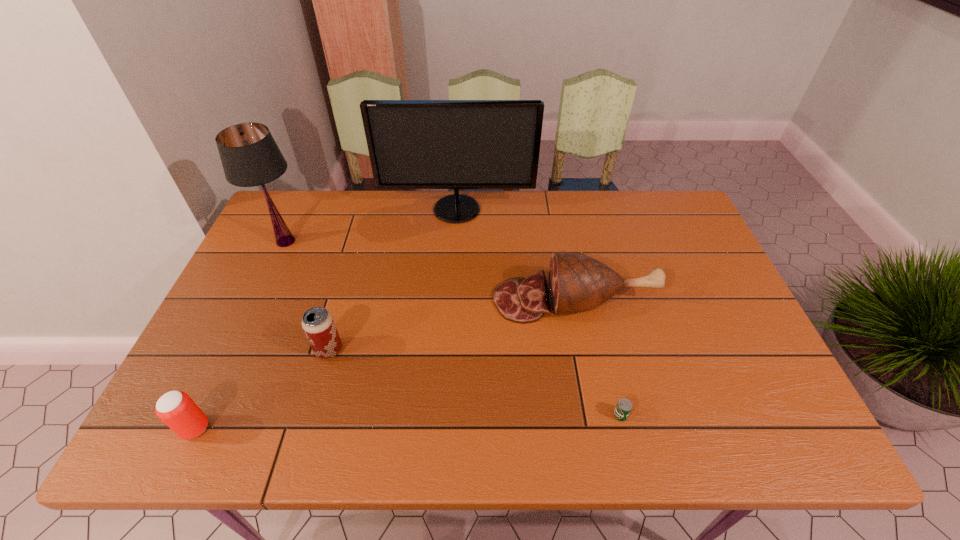
Identify the location of vacant space that satisfies the following two spatial constraints: 1. on the front-facing side of the lampshade; 2. on the back side of the fourth farthest object. The width and height of the screenshot is (960, 540). (236, 350).

Locate an element on the screen. The height and width of the screenshot is (540, 960). free point that satisfies the following two spatial constraints: 1. on the front-facing side of the second beer can from left to right; 2. on the left side of the second farthest object is located at coordinates (236, 350).

What are the coordinates of `free region that satisfies the following two spatial constraints: 1. on the front-facing side of the farthest object; 2. on the right side of the shortest object` in the screenshot? It's located at (444, 415).

Identify the location of free region that satisfies the following two spatial constraints: 1. on the back side of the leftmost beer can; 2. on the right side of the rightmost beer can. This screenshot has width=960, height=540. (202, 415).

Image resolution: width=960 pixels, height=540 pixels. In order to click on vacant space that satisfies the following two spatial constraints: 1. on the back side of the shortest object; 2. at the sliced end of the ham in this screenshot , I will do `click(593, 300)`.

At what (x,y) coordinates should I click in order to perform the action: click on blank area in the image that satisfies the following two spatial constraints: 1. at the sliced end of the ham; 2. on the front side of the leftmost beer can. Please return your answer as a coordinate pair (x, y). Image resolution: width=960 pixels, height=540 pixels. Looking at the image, I should click on (600, 428).